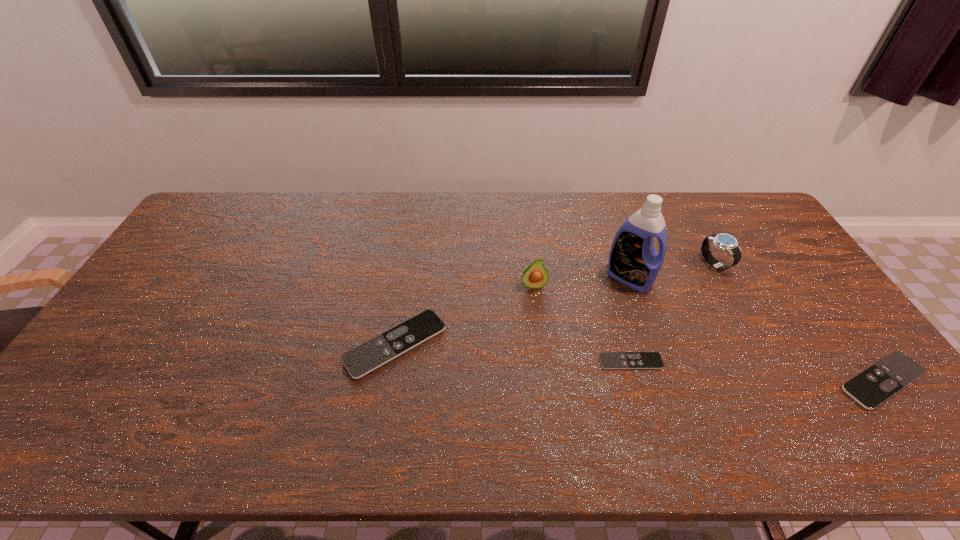
Given the evenly spaced remote controls in the image, where should an extra remote control be added on the left to preserve the spacing? Please point to a vacant space. Please provide its 2D coordinates. Your answer should be formatted as a tuple, i.e. [(x, y)], where the tuple contains the x and y coordinates of a point satisfying the conditions above.

[(176, 328)]